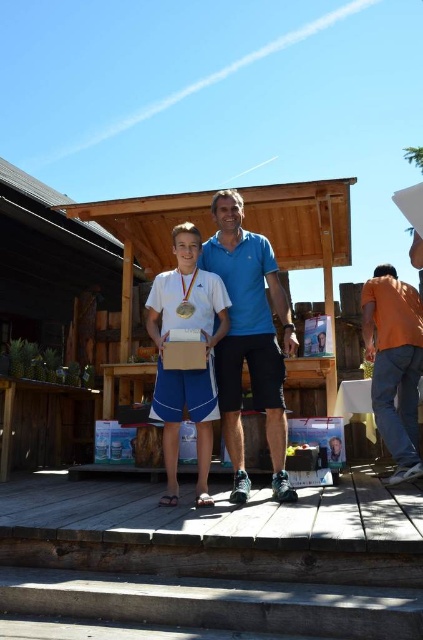
You are a photographer taking a picture of the blue fabric shirt at center and the gold metallic medal at center. Which object should you focus on first if you want to ensure both are in focus, given that your camera can only focus on one object at a time?

The blue fabric shirt at center is taller than the gold metallic medal at center, so you should focus on the blue fabric shirt at center first to ensure both are in focus.

You are a photographer taking a picture of the blue fabric shirt at center and the gold metallic medal at center. Which object should you focus on first if you want to ensure both are in sharp focus?

The blue fabric shirt at center is wider than the gold metallic medal at center, so focusing on the wider object first would help ensure both are in sharp focus.